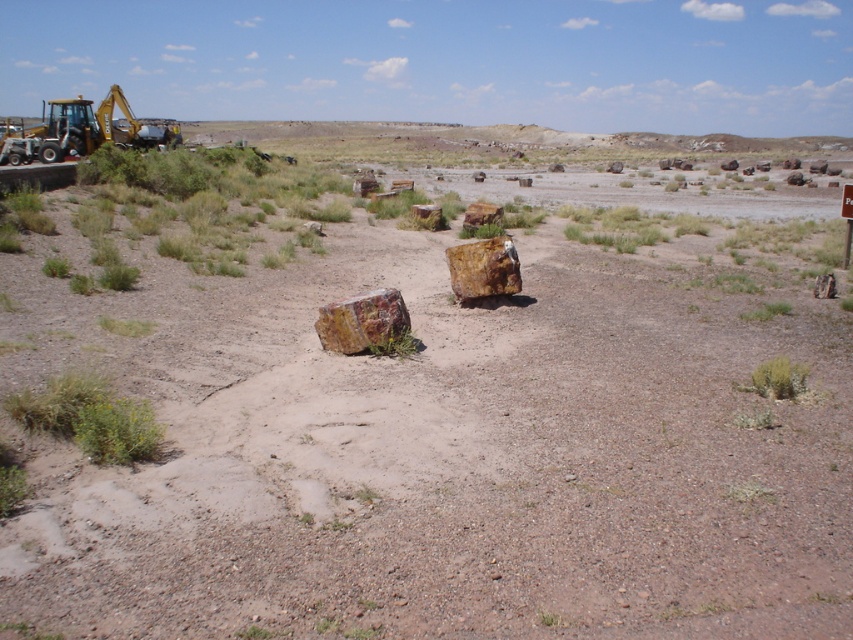
Question: Which point appears closest to the camera in this image?

Choices:
 (A) (65, 150)
 (B) (772, 323)

Answer: (B)

Question: Does brown textured rock at center have a lesser width compared to yellow-green metal excavator at upper left?

Choices:
 (A) yes
 (B) no

Answer: (A)

Question: Is brown textured rock at center to the left of yellow-green metal excavator at upper left from the viewer's perspective?

Choices:
 (A) no
 (B) yes

Answer: (A)

Question: Can you confirm if brown textured rock at center is wider than yellow-green metal excavator at upper left?

Choices:
 (A) no
 (B) yes

Answer: (A)

Question: Which point is farther from the camera taking this photo?

Choices:
 (A) (297, 244)
 (B) (148, 138)

Answer: (B)